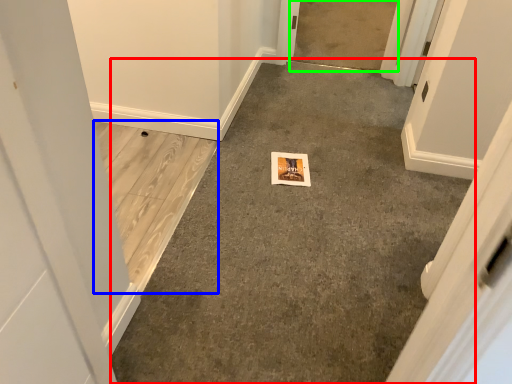
Question: Which object is positioned farthest from concrete (highlighted by a red box)? Select from concrete (highlighted by a blue box) and concrete (highlighted by a green box).

Choices:
 (A) concrete
 (B) concrete

Answer: (B)